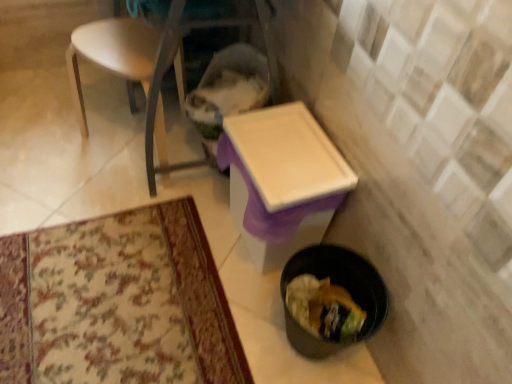
What is the approximate width of black plastic trash can at lower right?

It is 10.89 inches.

The height and width of the screenshot is (384, 512). What do you see at coordinates (343, 279) in the screenshot?
I see `black plastic trash can at lower right` at bounding box center [343, 279].

Measure the distance between point (116, 26) and camera.

Point (116, 26) and camera are 4.76 feet apart.

Where is `black plastic trash can at lower right`? black plastic trash can at lower right is located at coordinates (343, 279).

From the image's perspective, would you say white plastic chair at upper left is positioned over white plastic table at center?

Indeed, from the image's perspective, white plastic chair at upper left is shown above white plastic table at center.

Can you confirm if white plastic chair at upper left is smaller than white plastic table at center?

Actually, white plastic chair at upper left might be larger than white plastic table at center.

Is white plastic chair at upper left aimed at white plastic table at center?

No, white plastic chair at upper left is not oriented towards white plastic table at center.

From a real-world perspective, is white plastic chair at upper left positioned above or below white plastic table at center?

In terms of real-world spatial position, white plastic chair at upper left is above white plastic table at center.

Are white plastic table at center and white plastic chair at upper left far apart?

No, white plastic table at center is in close proximity to white plastic chair at upper left.

From a real-world perspective, is white plastic table at center physically located above or below white plastic chair at upper left?

From a real-world perspective, white plastic table at center is physically below white plastic chair at upper left.

Which is more to the right, white plastic table at center or white plastic chair at upper left?

From the viewer's perspective, white plastic table at center appears more on the right side.

Between point (233, 172) and point (67, 53), which one is positioned in front?

The point (233, 172) is closer.

From a real-world perspective, is white plastic chair at upper left positioned above or below black plastic trash can at lower right?

Clearly, from a real-world perspective, white plastic chair at upper left is above black plastic trash can at lower right.

Is white plastic chair at upper left facing towards black plastic trash can at lower right?

No, white plastic chair at upper left is not turned towards black plastic trash can at lower right.

Is white plastic chair at upper left in front of black plastic trash can at lower right?

No, white plastic chair at upper left is behind black plastic trash can at lower right.

From the image's perspective, is white plastic table at center on top of black plastic trash can at lower right?

Indeed, from the image's perspective, white plastic table at center is shown above black plastic trash can at lower right.

Identify the location of table that appears above the black plastic trash can at lower right (from the image's perspective). The height and width of the screenshot is (384, 512). (288, 156).

From a real-world perspective, is white plastic table at center positioned above or below black plastic trash can at lower right?

white plastic table at center is above black plastic trash can at lower right.

Does white plastic table at center contain black plastic trash can at lower right?

No, black plastic trash can at lower right is not surrounded by white plastic table at center.

Which point is more distant from viewer, (360, 272) or (76, 99)?

Point (76, 99)

From the image's perspective, is black plastic trash can at lower right located beneath white plastic chair at upper left?

Yes, from the image's perspective, black plastic trash can at lower right is beneath white plastic chair at upper left.

Between black plastic trash can at lower right and white plastic chair at upper left, which one has smaller width?

black plastic trash can at lower right is thinner.

From the image's perspective, between black plastic trash can at lower right and white plastic table at center, who is located below?

black plastic trash can at lower right.

Is black plastic trash can at lower right positioned beyond the bounds of white plastic table at center?

Yes, black plastic trash can at lower right is located beyond the bounds of white plastic table at center.

The image size is (512, 384). In order to click on potty below the white plastic table at center (from the image's perspective) in this screenshot , I will do [343, 279].

Based on their sizes in the image, would you say black plastic trash can at lower right is bigger or smaller than white plastic table at center?

Considering their sizes, black plastic trash can at lower right takes up less space than white plastic table at center.

At what (x,y) coordinates should I click in order to perform the action: click on chair on the left of white plastic table at center. Please return your answer as a coordinate pair (x, y). This screenshot has height=384, width=512. Looking at the image, I should click on 126,57.

Where is `table in front of the white plastic chair at upper left`? table in front of the white plastic chair at upper left is located at coordinates (288, 156).

Considering their positions, is white plastic table at center positioned closer to white plastic chair at upper left than black plastic trash can at lower right?

white plastic table at center.

Based on their spatial positions, is black plastic trash can at lower right or white plastic chair at upper left further from white plastic table at center?

Based on the image, white plastic chair at upper left appears to be further to white plastic table at center.

Considering their positions, is white plastic chair at upper left positioned further to black plastic trash can at lower right than white plastic table at center?

white plastic chair at upper left.

Considering their positions, is white plastic chair at upper left positioned closer to white plastic table at center than black plastic trash can at lower right?

black plastic trash can at lower right is closer to white plastic table at center.

Based on their spatial positions, is white plastic table at center or white plastic chair at upper left further from black plastic trash can at lower right?

white plastic chair at upper left is further to black plastic trash can at lower right.

Considering their positions, is black plastic trash can at lower right positioned closer to white plastic chair at upper left than white plastic table at center?

Among the two, white plastic table at center is located nearer to white plastic chair at upper left.

Where is `table between white plastic chair at upper left and black plastic trash can at lower right from left to right`? The width and height of the screenshot is (512, 384). table between white plastic chair at upper left and black plastic trash can at lower right from left to right is located at coordinates (288, 156).